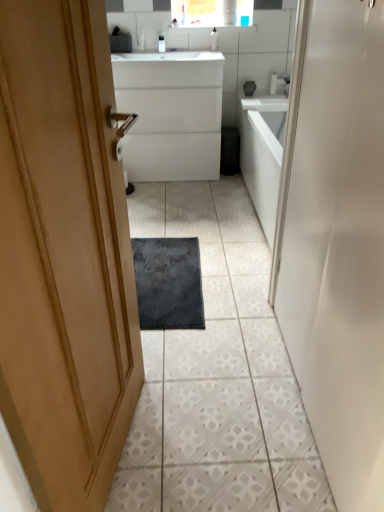
Question: From a real-world perspective, is white glossy soap dispenser at upper center, placed as the 1th toiletry when sorted from right to left, physically above matte white faucet at upper center?

Choices:
 (A) no
 (B) yes

Answer: (A)

Question: Is white glossy soap dispenser at upper center, placed as the 1th toiletry when sorted from right to left, smaller than matte white faucet at upper center?

Choices:
 (A) no
 (B) yes

Answer: (A)

Question: Is white glossy soap dispenser at upper center, placed as the 1th toiletry when sorted from right to left, thinner than matte white faucet at upper center?

Choices:
 (A) yes
 (B) no

Answer: (A)

Question: Are white glossy soap dispenser at upper center, placed as the second toiletry when sorted from left to right, and matte white faucet at upper center located far from each other?

Choices:
 (A) yes
 (B) no

Answer: (B)

Question: From the image's perspective, is white glossy soap dispenser at upper center, placed as the second toiletry when sorted from left to right, below matte white faucet at upper center?

Choices:
 (A) no
 (B) yes

Answer: (B)

Question: From their relative heights in the image, would you say matte white faucet at upper center is taller or shorter than dark gray textured bath mat at center?

Choices:
 (A) tall
 (B) short

Answer: (A)

Question: Is point [x=173, y=25] positioned closer to the camera than point [x=195, y=270]?

Choices:
 (A) closer
 (B) farther

Answer: (B)

Question: From a real-world perspective, is matte white faucet at upper center above or below dark gray textured bath mat at center?

Choices:
 (A) above
 (B) below

Answer: (A)

Question: Considering the positions of matte white faucet at upper center and dark gray textured bath mat at center in the image, is matte white faucet at upper center wider or thinner than dark gray textured bath mat at center?

Choices:
 (A) thin
 (B) wide

Answer: (A)

Question: In terms of height, does dark gray textured bath mat at center look taller or shorter compared to white glossy door at center?

Choices:
 (A) short
 (B) tall

Answer: (A)

Question: Choose the correct answer: Is dark gray textured bath mat at center inside white glossy door at center or outside it?

Choices:
 (A) inside
 (B) outside

Answer: (B)

Question: In terms of width, does dark gray textured bath mat at center look wider or thinner when compared to white glossy door at center?

Choices:
 (A) wide
 (B) thin

Answer: (A)

Question: In the image, is dark gray textured bath mat at center on the left side or the right side of white glossy door at center?

Choices:
 (A) right
 (B) left

Answer: (B)

Question: In the image, is dark gray textured bath mat at center on the left side or the right side of white glossy cabinet at center?

Choices:
 (A) left
 (B) right

Answer: (B)

Question: Is dark gray textured bath mat at center wider or thinner than white glossy cabinet at center?

Choices:
 (A) thin
 (B) wide

Answer: (B)